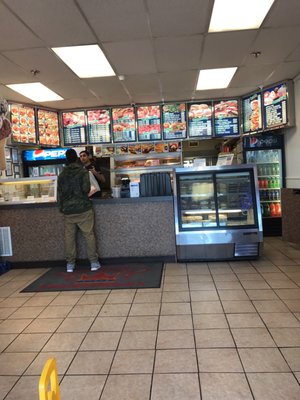
Identify the location of fire sprinkler. (256, 56), (36, 71).